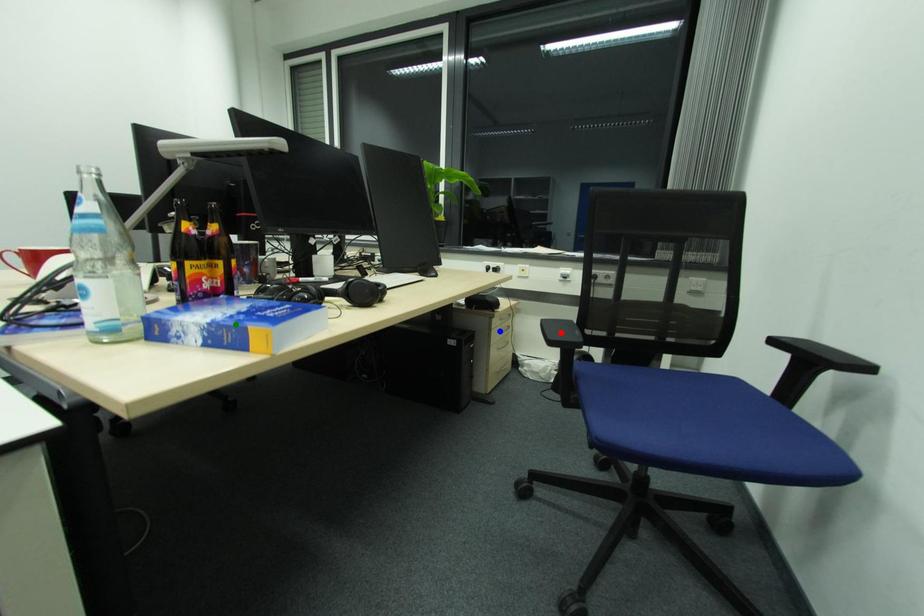
Order these from nearest to farthest:
1. green point
2. red point
3. blue point

blue point
red point
green point